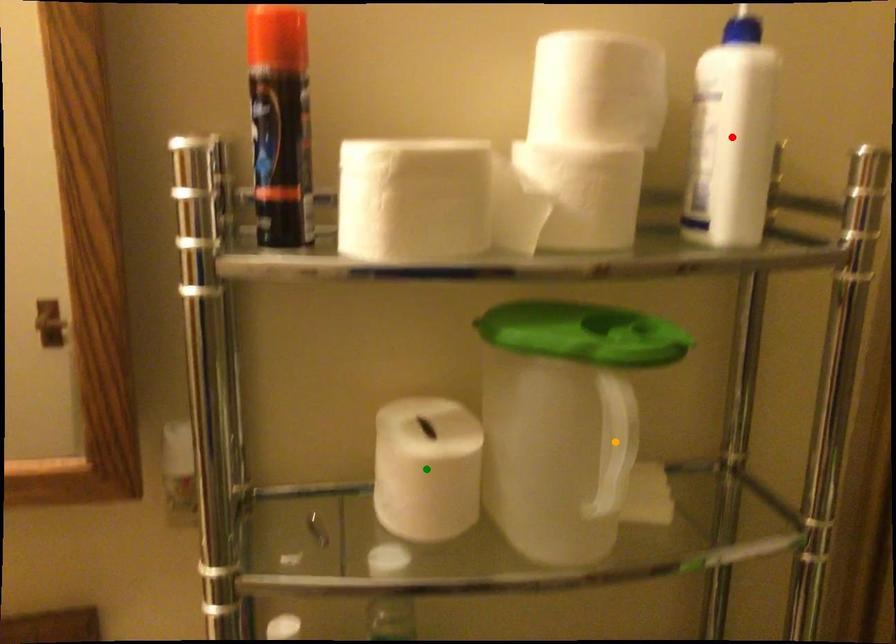
Order these from nearest to farthest:
- red point
- orange point
- green point

green point, red point, orange point